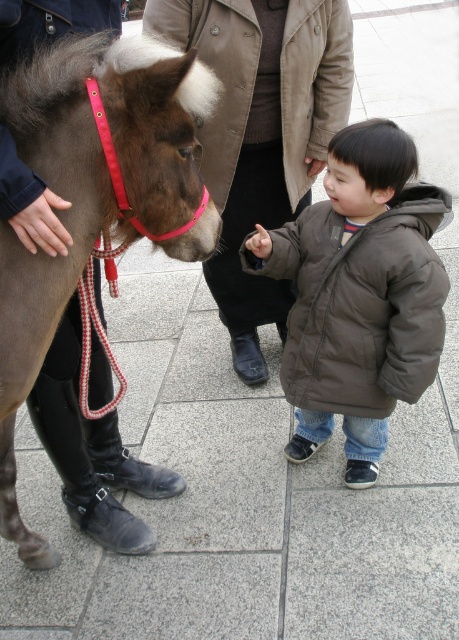
Question: Is brown leather mule at center positioned behind brown puffy jacket at center?

Choices:
 (A) no
 (B) yes

Answer: (A)

Question: Which object appears farthest from the camera in this image?

Choices:
 (A) brown cotton jacket at center
 (B) brown puffy jacket at center
 (C) brown leather mule at center

Answer: (B)

Question: Estimate the real-world distances between objects in this image. Which object is farther from the brown leather mule at center?

Choices:
 (A) brown cotton jacket at center
 (B) brown puffy jacket at center

Answer: (A)

Question: In this image, where is brown puffy jacket at center located relative to brown cotton jacket at center?

Choices:
 (A) right
 (B) left

Answer: (A)

Question: Which point appears farthest from the camera in this image?

Choices:
 (A) (347, 10)
 (B) (4, 472)

Answer: (A)

Question: Does brown leather mule at center appear over brown puffy jacket at center?

Choices:
 (A) no
 (B) yes

Answer: (B)